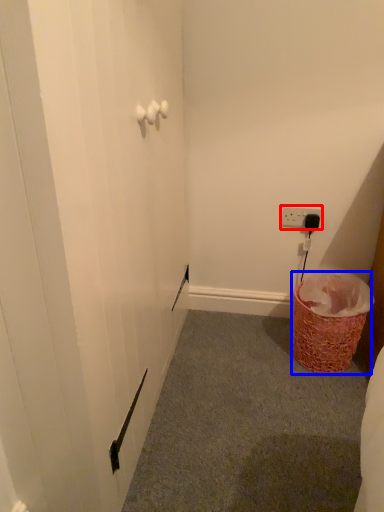
Question: Which of the following is the farthest to the observer, electric outlet (highlighted by a red box) or basket (highlighted by a blue box)?

Choices:
 (A) electric outlet
 (B) basket

Answer: (A)